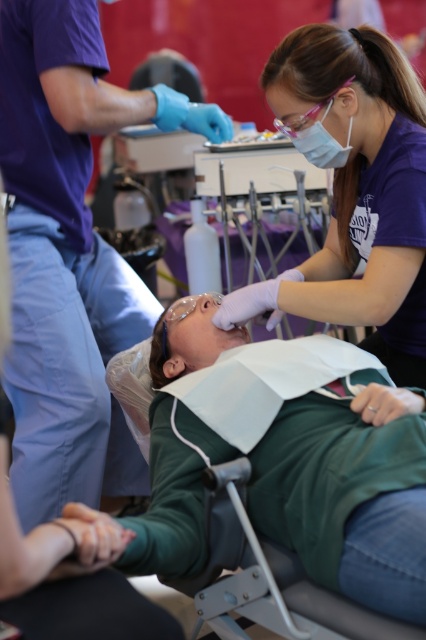
Question: Which is nearer to the purple smooth shirt at upper center?

Choices:
 (A) green fabric at center
 (B) matte purple shirt at upper right

Answer: (A)

Question: Which object is closer to the camera taking this photo?

Choices:
 (A) matte purple shirt at upper right
 (B) purple smooth shirt at upper center

Answer: (B)

Question: Considering the relative positions of green fabric at center and purple smooth shirt at upper center in the image provided, where is green fabric at center located with respect to purple smooth shirt at upper center?

Choices:
 (A) above
 (B) below

Answer: (B)

Question: Which of the following is the closest to the observer?

Choices:
 (A) purple smooth shirt at upper center
 (B) matte purple shirt at upper right
 (C) green fabric at center

Answer: (C)

Question: Does green fabric at center come behind matte purple shirt at upper right?

Choices:
 (A) no
 (B) yes

Answer: (A)

Question: Is green fabric at center positioned behind purple smooth shirt at upper center?

Choices:
 (A) yes
 (B) no

Answer: (B)